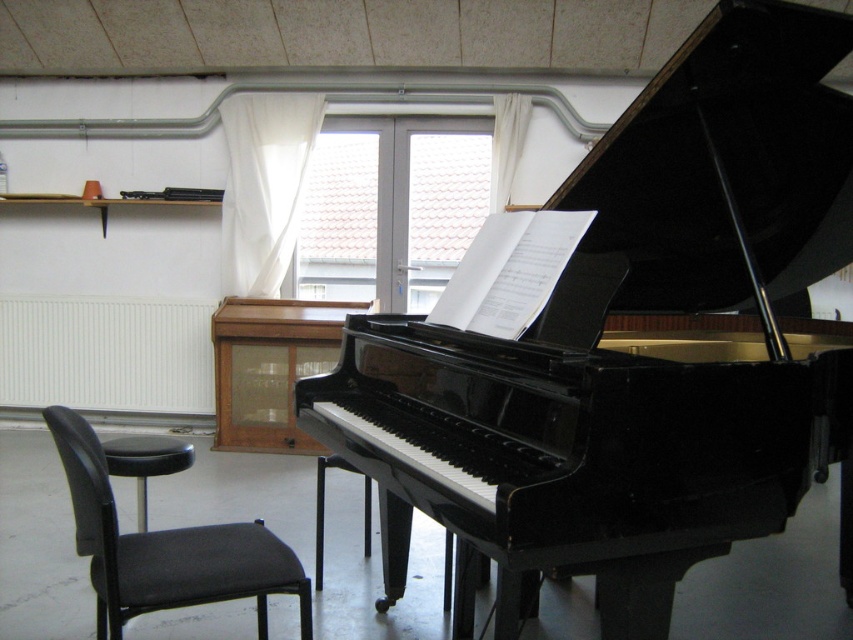
You are a musician who wants to sit closer to the piano to read the sheet music. Which object should you choose between the glossy black piano at center and the black leather stool at lower left?

You should choose the glossy black piano at center because it is closer to the viewer than the black leather stool at lower left.

You are standing in the music room and want to sit down at the piano. Which object should you approach first, the point at (x=630, y=348) or the black chair to the left?

The point at (x=630, y=348) corresponds to the glossy black piano at center, so you should approach the black chair to the left first to sit down before reaching the piano.